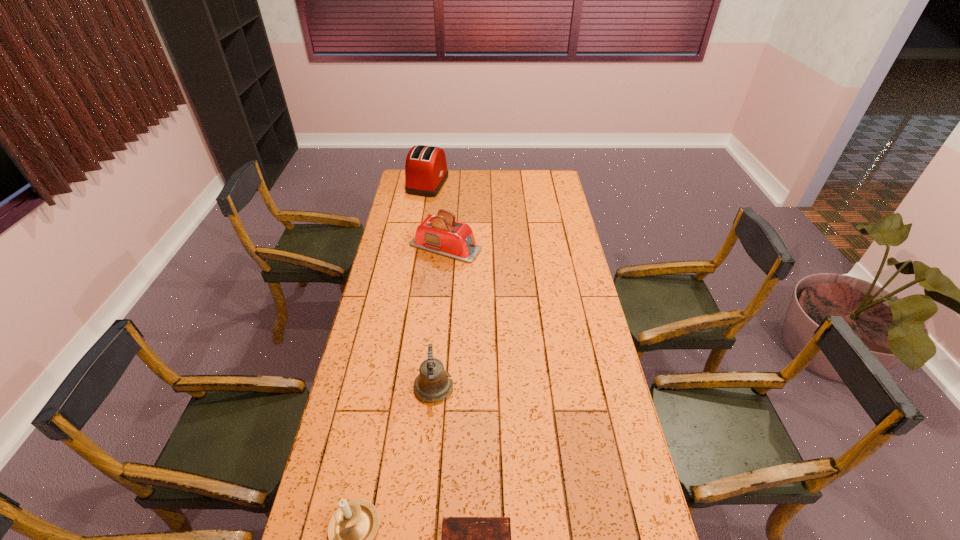
Locate an element on the screen. This screenshot has height=540, width=960. vacant space at the far right corner is located at coordinates (562, 190).

Where is `blank region between the third nearest object and the farthest object`? This screenshot has height=540, width=960. blank region between the third nearest object and the farthest object is located at coordinates (431, 286).

This screenshot has height=540, width=960. What are the coordinates of `object that is the third closest one to the shortest object` in the screenshot? It's located at (440, 234).

This screenshot has width=960, height=540. What are the coordinates of `object that is the second nearest to the farthest object` in the screenshot? It's located at (431, 385).